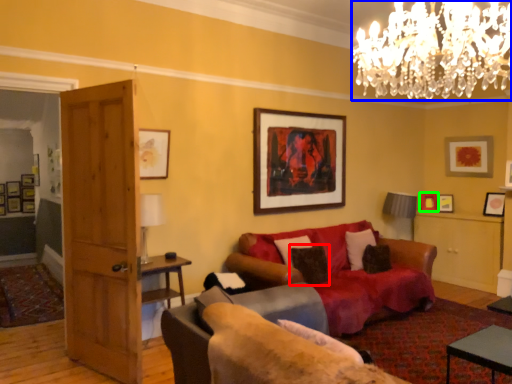
Question: Based on their relative distances, which object is nearer to pillow (highlighted by a red box)? Choose from lamp (highlighted by a blue box) and picture frame (highlighted by a green box).

Choices:
 (A) lamp
 (B) picture frame

Answer: (A)